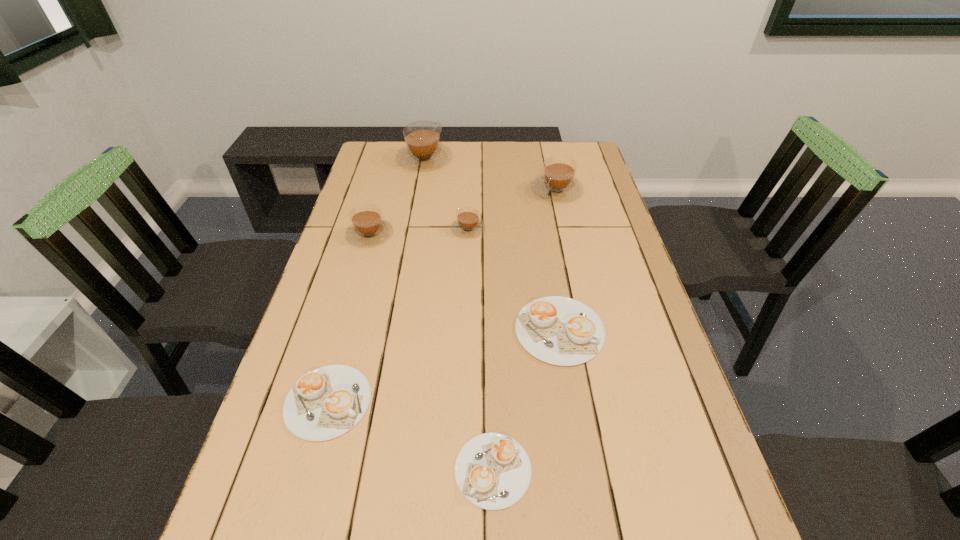
Where is `the second smallest white cappuccino`? the second smallest white cappuccino is located at coordinates (325, 403).

What are the coordinates of `the leftmost white cappuccino` in the screenshot? It's located at (325, 403).

Where is `the shortest cappuccino`? The image size is (960, 540). the shortest cappuccino is located at coordinates (492, 470).

In order to click on the shortest object in this screenshot , I will do `click(492, 470)`.

The image size is (960, 540). Find the location of `vacant position located 0.120m on the front of the tallest object`. vacant position located 0.120m on the front of the tallest object is located at coordinates (419, 192).

The image size is (960, 540). Identify the location of free point located 0.220m on the left of the second tallest cappuccino. (467, 190).

Where is `free space located 0.210m on the right of the third tallest object`? This screenshot has height=540, width=960. free space located 0.210m on the right of the third tallest object is located at coordinates (463, 234).

Find the location of a particular element. This screenshot has height=540, width=960. free spot located on the left of the fourth tallest cappuccino is located at coordinates (424, 229).

The height and width of the screenshot is (540, 960). In order to click on vacant point located 0.330m on the back of the fifth tallest object in this screenshot , I will do `click(541, 221)`.

Find the location of a particular element. free space located on the right of the sixth tallest cappuccino is located at coordinates (498, 402).